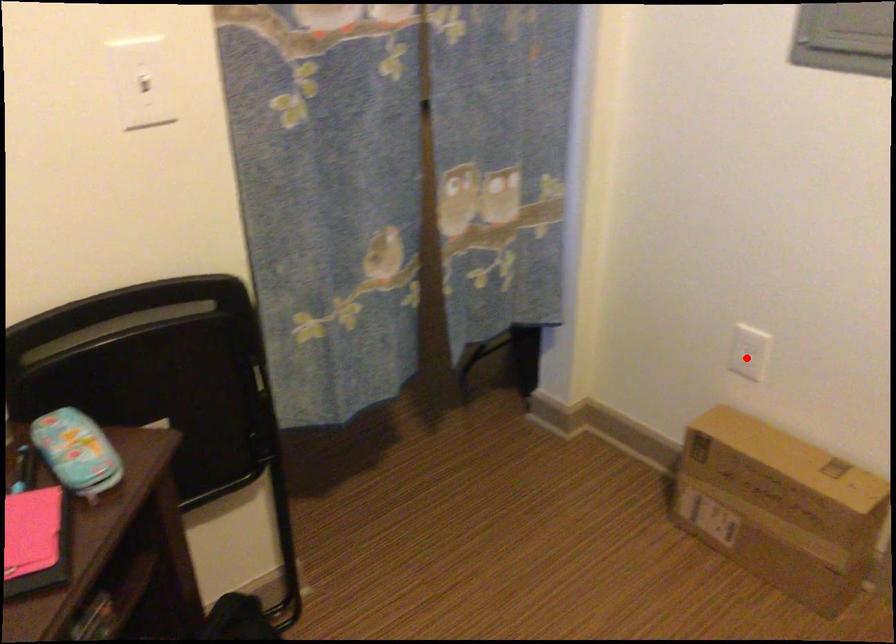
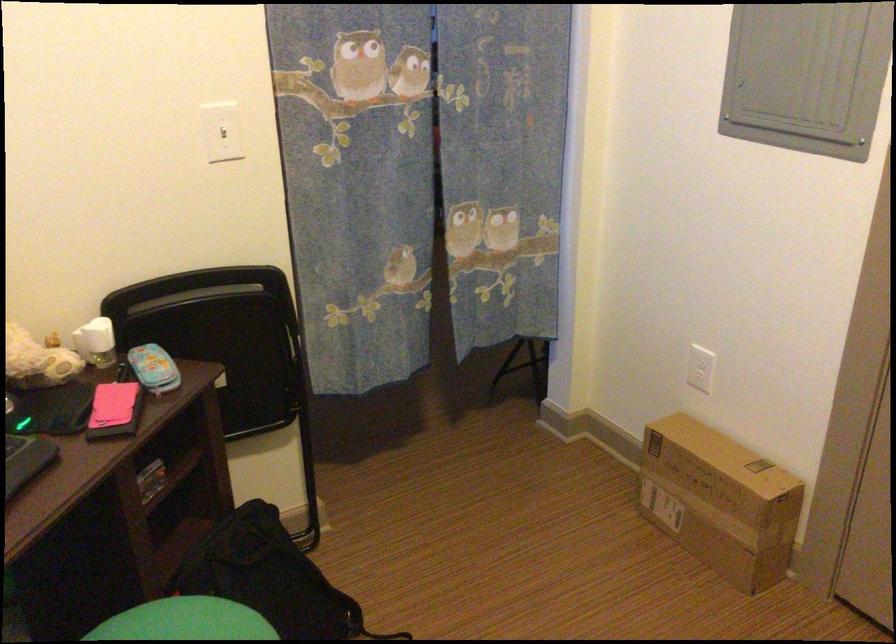
Where in the second image is the point corresponding to the highlighted location from the first image?

(700, 368)